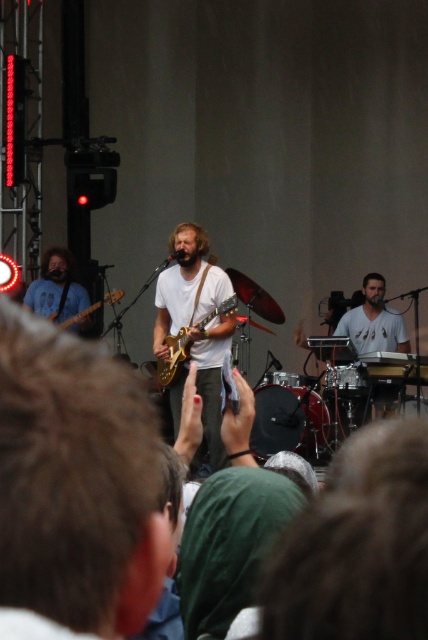
Between white matte guitar at center and shiny metallic guitar at center, which one is positioned higher?

shiny metallic guitar at center

Based on the photo, which is more to the left, white matte guitar at center or shiny metallic guitar at center?

shiny metallic guitar at center is more to the left.

Looking at this image, who is more forward, (160,280) or (53,314)?

Point (160,280)

What are the coordinates of `white matte guitar at center` in the screenshot? It's located at (196, 323).

Which is above, white matte shirt at center or shiny metallic guitar at center?

shiny metallic guitar at center is above.

Is point (376, 326) more distant than point (65, 324)?

No, (376, 326) is in front of (65, 324).

This screenshot has width=428, height=640. What are the coordinates of `white matte shirt at center` in the screenshot? It's located at (374, 321).

Based on the photo, who is lower down, white matte guitar at center or white matte shirt at center?

white matte guitar at center

Who is more forward, (175, 412) or (350, 323)?

Point (175, 412)

Where is `white matte guitar at center`? The width and height of the screenshot is (428, 640). white matte guitar at center is located at coordinates (196, 323).